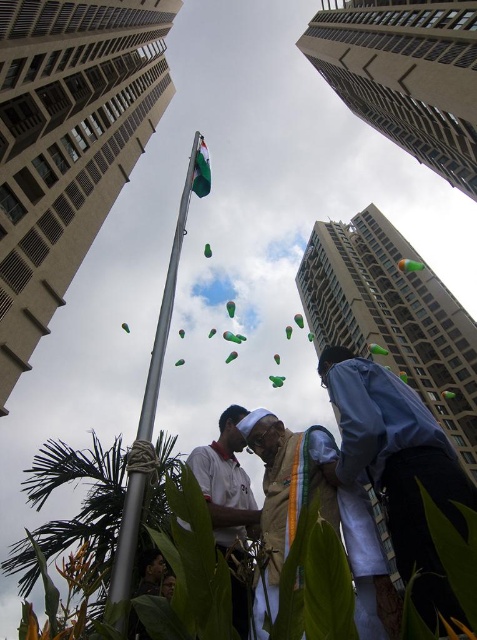
Question: Is blue fabric shirt at lower right thinner than white matte shirt at center?

Choices:
 (A) yes
 (B) no

Answer: (B)

Question: Which point appears farthest from the camera in this image?

Choices:
 (A) (215, 538)
 (B) (333, 508)

Answer: (A)

Question: Does white matte shirt at center lie behind green fabric flag at center?

Choices:
 (A) no
 (B) yes

Answer: (A)

Question: Which point is closer to the camera taking this photo?

Choices:
 (A) (216, 538)
 (B) (201, 140)
 (C) (263, 488)
 (D) (157, 388)

Answer: (D)

Question: Is blue fabric shirt at lower right smaller than white matte shirt at center?

Choices:
 (A) yes
 (B) no

Answer: (B)

Question: Which object is closer to the camera taking this photo?

Choices:
 (A) light brown fabric at center
 (B) silver metallic flag pole at center
 (C) blue fabric shirt at lower right
 (D) white matte shirt at center

Answer: (C)